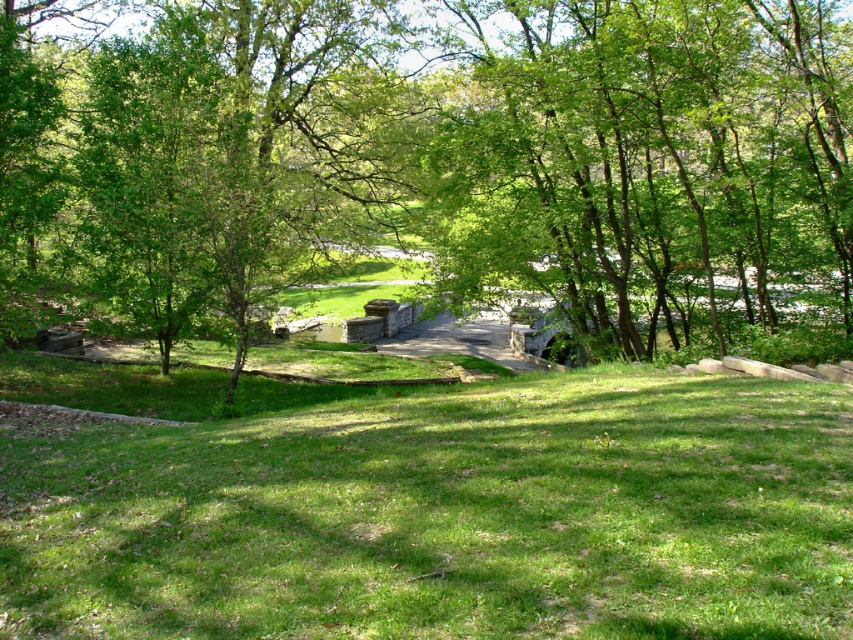
Question: Observing the image, what is the correct spatial positioning of green leafy tree at center in reference to green grassy at center?

Choices:
 (A) above
 (B) below

Answer: (A)

Question: Observing the image, what is the correct spatial positioning of green leafy tree at center in reference to green grassy at center?

Choices:
 (A) below
 (B) above

Answer: (B)

Question: Which point is farther to the camera?

Choices:
 (A) (312, 36)
 (B) (223, 472)

Answer: (A)

Question: Does green leafy tree at center appear over green grassy at center?

Choices:
 (A) yes
 (B) no

Answer: (A)

Question: Which of the following is the closest to the observer?

Choices:
 (A) (653, 224)
 (B) (136, 500)

Answer: (B)